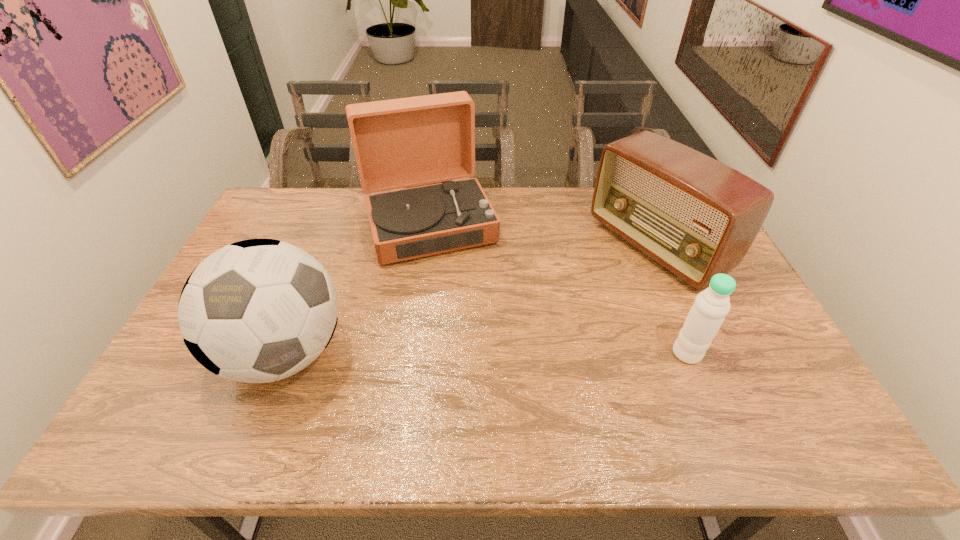
Where is `blank area at the right edge`? The height and width of the screenshot is (540, 960). blank area at the right edge is located at coordinates [x=722, y=345].

Where is `blank space at the far left corner of the desktop`? blank space at the far left corner of the desktop is located at coordinates [x=260, y=215].

Image resolution: width=960 pixels, height=540 pixels. What are the coordinates of `free space between the phonograph record and the radio receiver` in the screenshot? It's located at (542, 235).

This screenshot has height=540, width=960. Identify the location of free space between the soccer ball and the water bottle. (486, 353).

What are the coordinates of `vacant region between the radio receiver and the phonograph record` in the screenshot? It's located at (542, 235).

Where is `free space between the soccer ball and the radio receiver`? The height and width of the screenshot is (540, 960). free space between the soccer ball and the radio receiver is located at coordinates (470, 300).

Where is `free space between the radio receiver and the soccer ball`? This screenshot has width=960, height=540. free space between the radio receiver and the soccer ball is located at coordinates (470, 300).

The width and height of the screenshot is (960, 540). What are the coordinates of `free space between the water bottle and the radio receiver` in the screenshot? It's located at (672, 300).

Find the location of a particular element. This screenshot has width=960, height=540. free space that is in between the radio receiver and the water bottle is located at coordinates (672, 300).

At what (x,y) coordinates should I click in order to perform the action: click on empty space that is in between the phonograph record and the radio receiver. Please return your answer as a coordinate pair (x, y). The height and width of the screenshot is (540, 960). Looking at the image, I should click on [x=542, y=235].